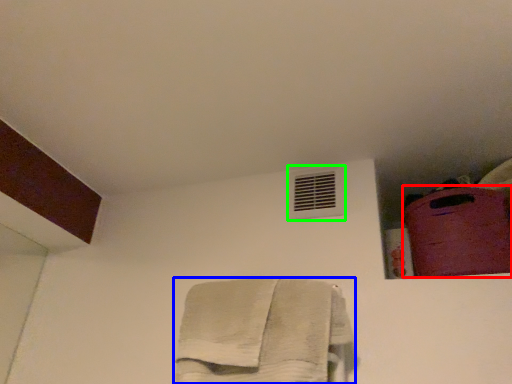
Question: Which object is positioned closest to luggage (highlighted by a red box)? Select from towel (highlighted by a blue box) and air conditioning (highlighted by a green box).

Choices:
 (A) towel
 (B) air conditioning

Answer: (B)